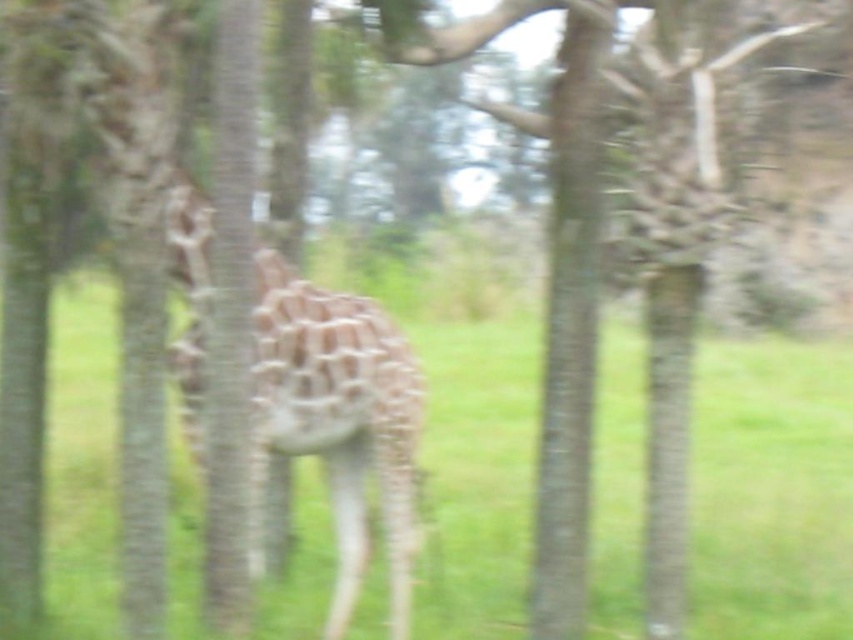
You are a photographer trying to capture the giraffe in the image. You notice two tree trunks at the center. Which tree trunk is closer to you, the smooth bark tree trunk at center or the brown rough tree trunk at center?

The smooth bark tree trunk at center is closer to you because the brown rough tree trunk at center is behind it.

You are a wildlife photographer trying to capture a clear image of the giraffe behind the smooth bark tree trunk at center. If your camera can focus on objects within 5 meters, will you be able to take a clear photo of the giraffe through the trunk?

The smooth bark tree trunk at center is 5.25 meters from viewer, which is beyond the camera focus range of 5 meters. Therefore, the camera cannot focus on the giraffe behind the trunk clearly.